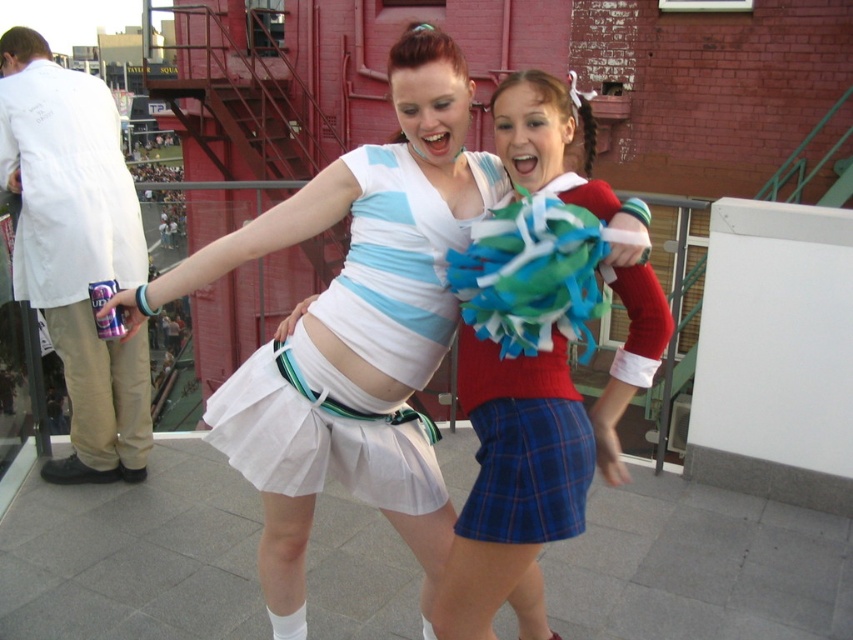
You are a photographer at the event and want to capture a clear photo of both the plaid fabric skirt at center and the white pleated skirt at center. Which one should you focus on first to ensure it appears sharp in the photo?

The plaid fabric skirt at center is in front of the white pleated skirt at center, so you should focus on the plaid fabric skirt at center first to ensure it appears sharp in the photo.

You are a photographer trying to capture both the white matte lab coat at left and the white pleated skirt at center in a single shot. However, due to the crowd, you can only focus on one subject at a time. Which subject should you focus on to ensure the other remains in the background?

You should focus on the white matte lab coat at left because the white pleated skirt at center is behind it, so keeping the lab coat in focus will naturally place the skirt in the background.